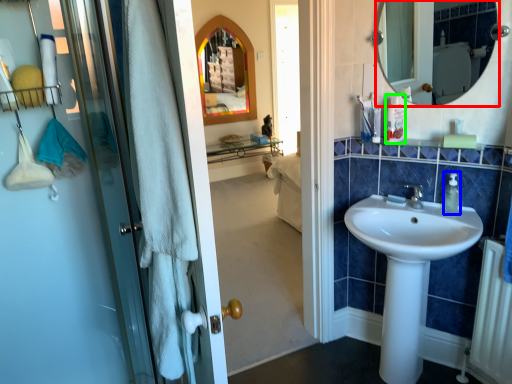
Question: Which object is positioned closest to mirror (highlighted by a red box)? Select from soap dispenser (highlighted by a blue box) and toiletry (highlighted by a green box).

Choices:
 (A) soap dispenser
 (B) toiletry

Answer: (B)